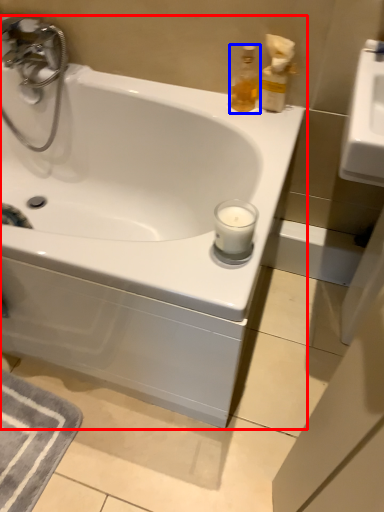
Question: Which object is further to the camera taking this photo, bathtub (highlighted by a red box) or soap dispenser (highlighted by a blue box)?

Choices:
 (A) bathtub
 (B) soap dispenser

Answer: (B)